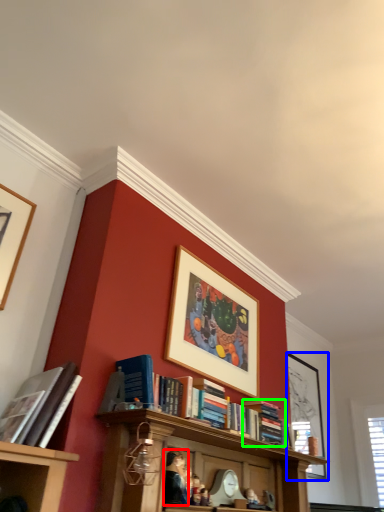
Question: Considering the real-world distances, which object is farthest from person (highlighted by a red box)? picture frame (highlighted by a blue box) or book (highlighted by a green box)?

Choices:
 (A) picture frame
 (B) book

Answer: (A)